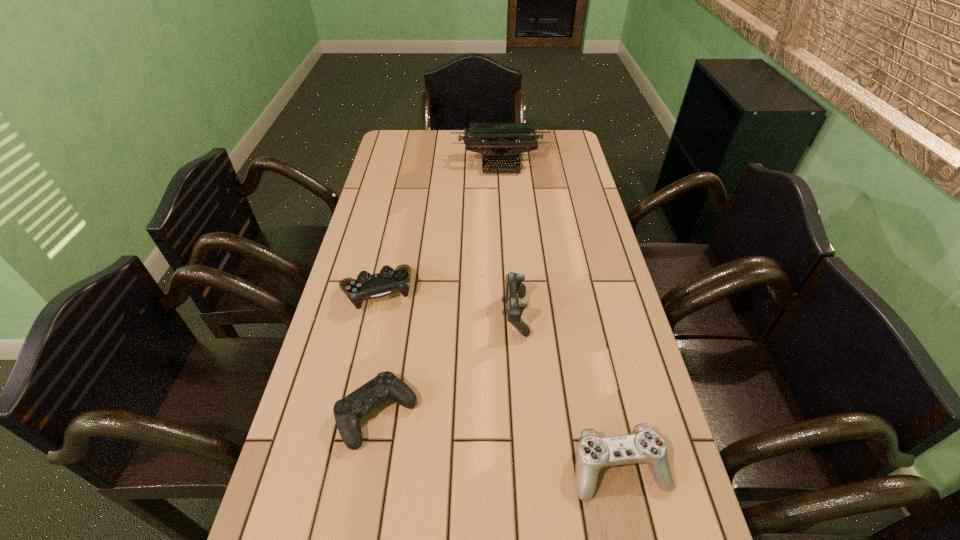
The image size is (960, 540). Identify the location of vacant area that lies between the tallest object and the rightmost control. (560, 316).

The height and width of the screenshot is (540, 960). I want to click on free area in between the rightmost control and the typewriter, so click(560, 316).

The image size is (960, 540). Find the location of `unoccupied position between the rightmost control and the third shortest control`. unoccupied position between the rightmost control and the third shortest control is located at coordinates (498, 380).

The width and height of the screenshot is (960, 540). Find the location of `vacant space that's between the second tallest control and the rightmost control`. vacant space that's between the second tallest control and the rightmost control is located at coordinates (498, 380).

Where is `free spot between the second control from right to left and the farthest object`? free spot between the second control from right to left and the farthest object is located at coordinates (508, 239).

This screenshot has height=540, width=960. I want to click on empty space between the typewriter and the rightmost control, so click(x=560, y=316).

This screenshot has width=960, height=540. Identify the location of free space between the fourth shortest object and the third shortest object. (445, 303).

Find the location of a particular element. This screenshot has width=960, height=540. free space that is in between the third shortest control and the farthest object is located at coordinates (439, 228).

Locate which object is the fourth closest to the rightmost control. Please provide its 2D coordinates. Your answer should be formatted as a tuple, i.e. [(x, y)], where the tuple contains the x and y coordinates of a point satisfying the conditions above.

[(500, 142)]

The height and width of the screenshot is (540, 960). Identify the location of object that is the third closest to the rightmost control. (366, 286).